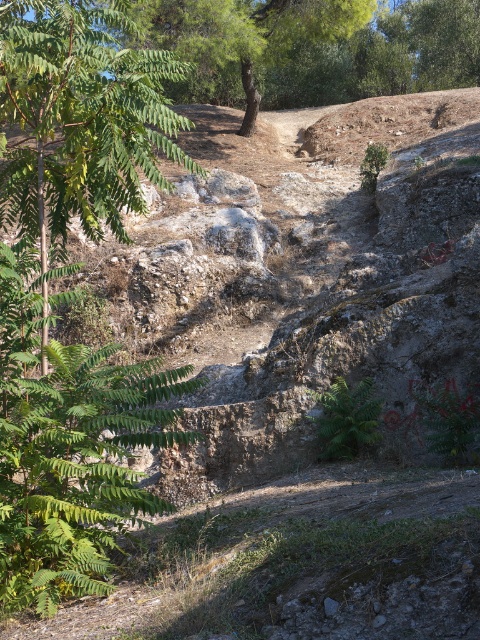
Is green leafy fern at left shorter than green leafy fern at center?

No, green leafy fern at left is not shorter than green leafy fern at center.

Is green leafy fern at left positioned before green leafy fern at center?

Yes, green leafy fern at left is closer to the viewer.

The width and height of the screenshot is (480, 640). I want to click on green leafy fern at left, so click(69, 449).

I want to click on green leafy fern at left, so click(69, 449).

Image resolution: width=480 pixels, height=640 pixels. I want to click on green leafy fern at left, so click(x=69, y=449).

Is point (172, 374) behind point (264, 10)?

That is False.

Between point (52, 362) and point (324, 26), which one is positioned behind?

Positioned behind is point (324, 26).

Where is `green leafy fern at left`? The height and width of the screenshot is (640, 480). green leafy fern at left is located at coordinates (69, 449).

Does green leafy tree at upper center lie behind green leafy fern at center?

No.

Who is higher up, green leafy tree at upper center or green leafy fern at center?

green leafy tree at upper center

The width and height of the screenshot is (480, 640). Find the location of `green leafy tree at upper center`. green leafy tree at upper center is located at coordinates (239, 40).

Locate an element on the screen. This screenshot has height=640, width=480. green leafy tree at upper center is located at coordinates (239, 40).